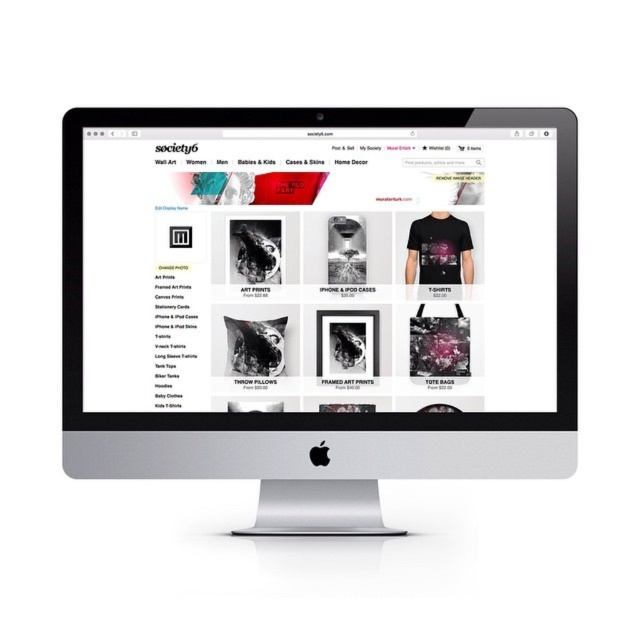
Question: Does silver metallic computer monitor at center appear over black matte t-shirt at center?

Choices:
 (A) yes
 (B) no

Answer: (B)

Question: Does silver metallic computer monitor at center have a larger size compared to black matte t-shirt at center?

Choices:
 (A) no
 (B) yes

Answer: (B)

Question: Which object is farther from the camera taking this photo?

Choices:
 (A) black matte t-shirt at center
 (B) silver metallic computer monitor at center

Answer: (A)

Question: Observing the image, what is the correct spatial positioning of silver metallic computer monitor at center in reference to black matte t-shirt at center?

Choices:
 (A) left
 (B) right

Answer: (A)